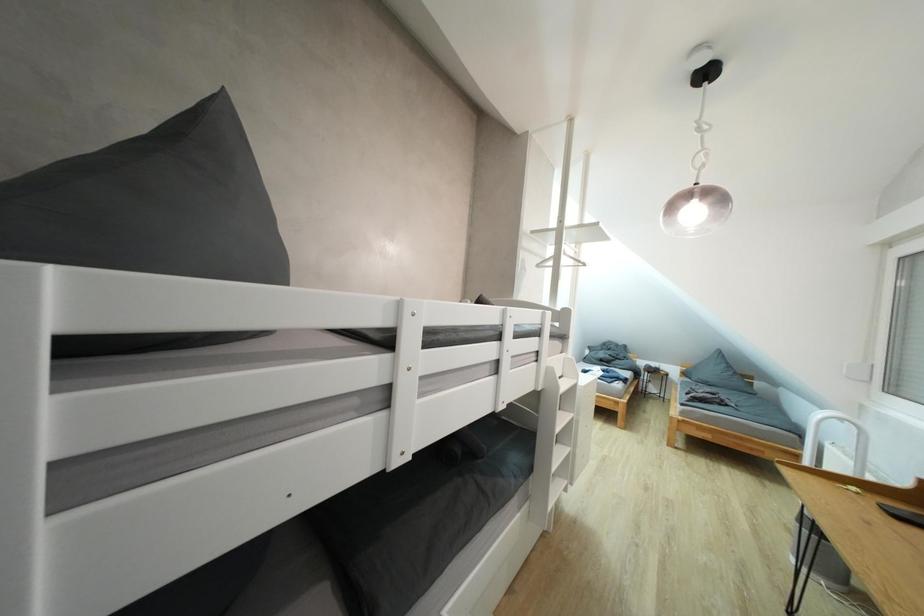
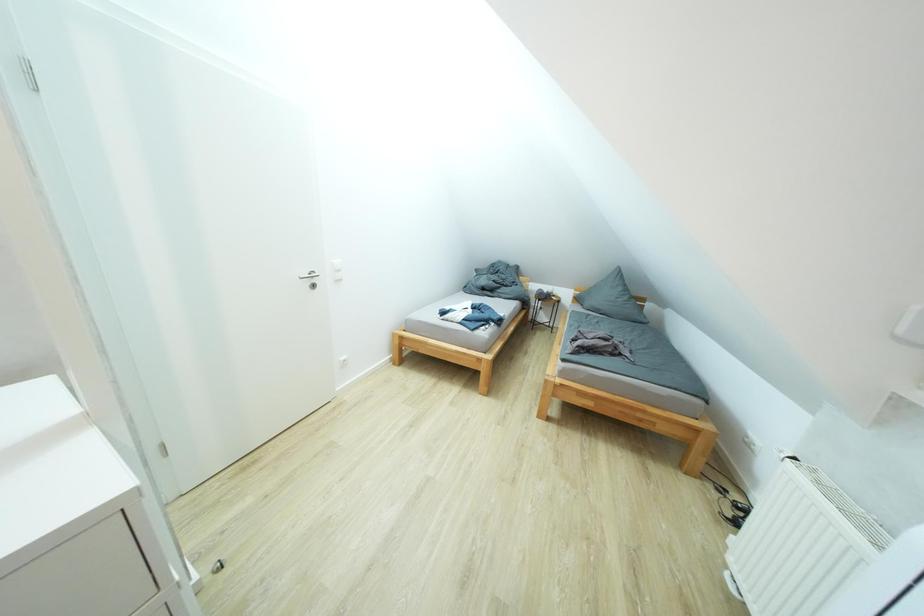
In a continuous first-person perspective shot, in which direction is the camera moving?

The cameraman moved toward right, forward.